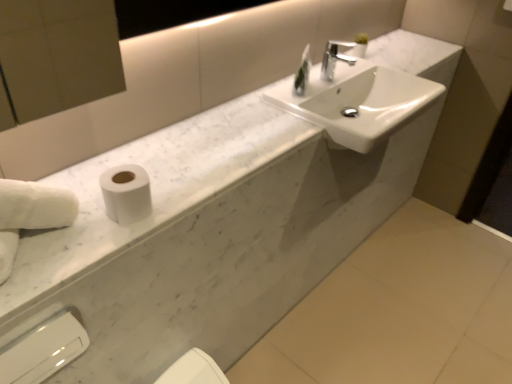
Question: Would you say white matte toilet paper at left is inside or outside white fluffy hand towel at left?

Choices:
 (A) outside
 (B) inside

Answer: (A)

Question: Considering the positions of point (140, 196) and point (53, 220), is point (140, 196) closer or farther from the camera than point (53, 220)?

Choices:
 (A) farther
 (B) closer

Answer: (A)

Question: Estimate the real-world distances between objects in this image. Which object is farther from the chrome metallic faucet at upper center?

Choices:
 (A) white glossy sink at upper center
 (B) white fluffy hand towel at left
 (C) white plastic hand dryer at lower left
 (D) white glossy bidet at lower center
 (E) white matte toilet paper at left

Answer: (C)

Question: Which object is the farthest from the white glossy bidet at lower center?

Choices:
 (A) white matte toilet paper at left
 (B) white glossy sink at upper center
 (C) white marble counter top at center
 (D) chrome metallic faucet at upper center
 (E) clear glass soap dispenser at upper center

Answer: (D)